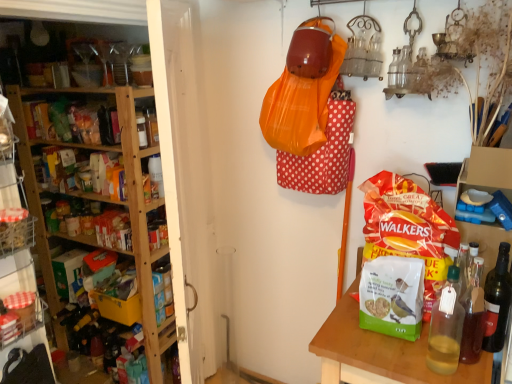
Locate an element on the screen. free space to the back side of translucent glass bottle at right, marked as the 1th bottle in a left-to-right arrangement is located at coordinates (422, 349).